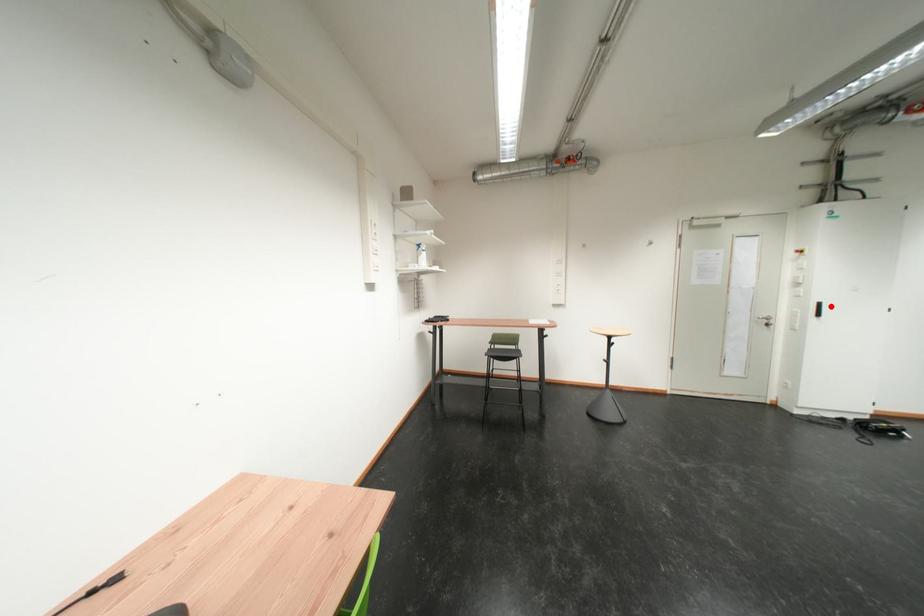
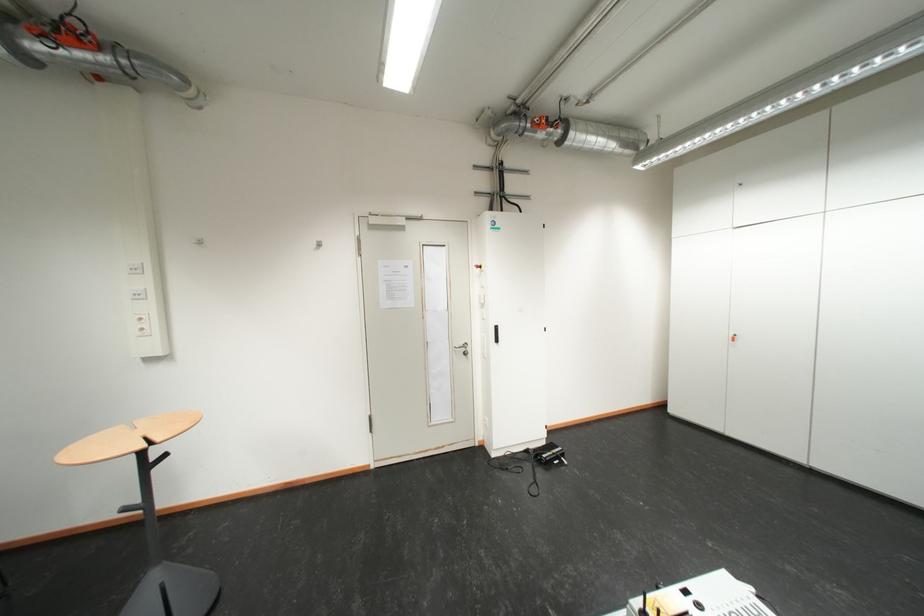
Where in the second image is the point corresponding to the highlighted location from the first image?

(507, 330)